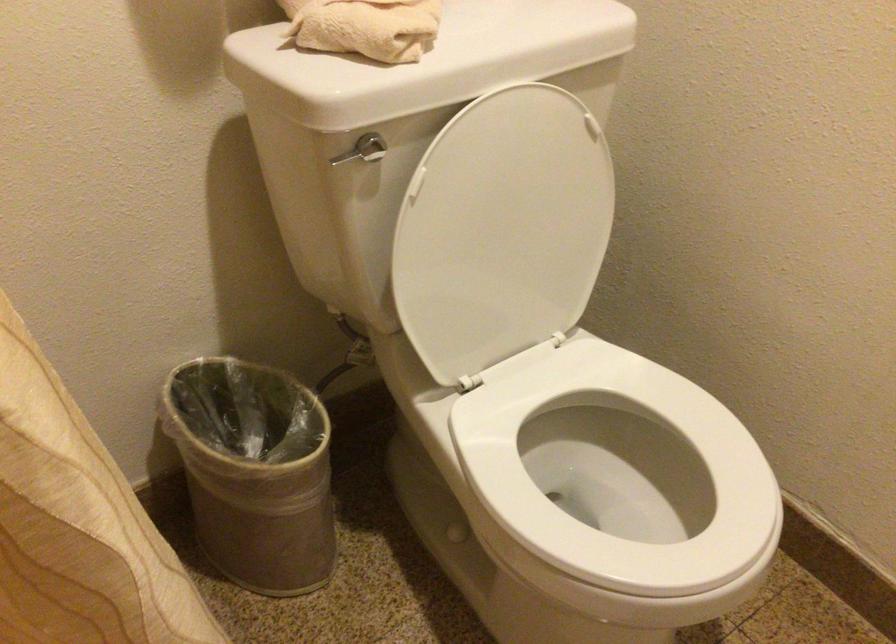
Find where to lift the white toilet lid. Please return your answer as a coordinate pair (x, y).

(502, 230)